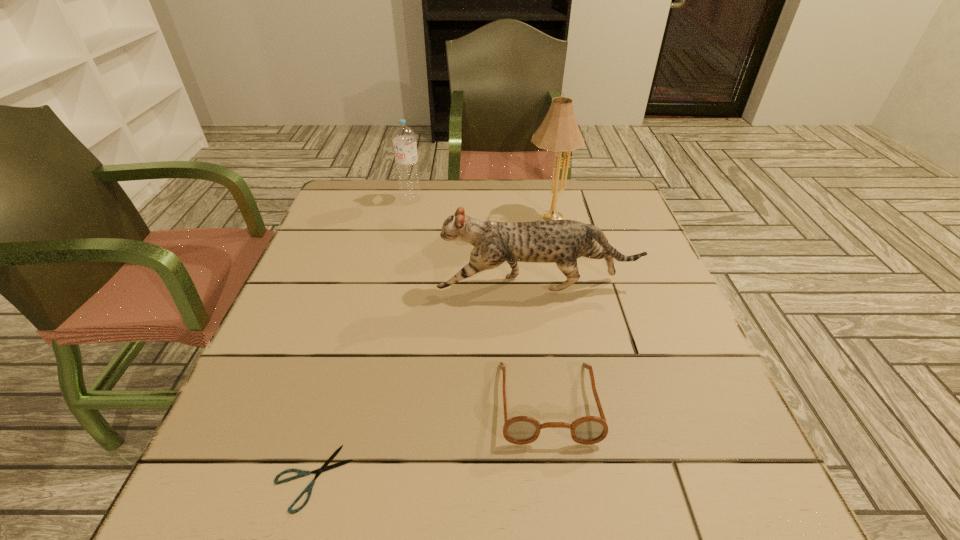
This screenshot has width=960, height=540. I want to click on the tallest object, so click(559, 132).

This screenshot has height=540, width=960. Find the location of `water bottle`. water bottle is located at coordinates (404, 138).

The image size is (960, 540). In order to click on cat in this screenshot , I will do `click(562, 241)`.

Locate an element on the screen. Image resolution: width=960 pixels, height=540 pixels. the third shortest object is located at coordinates (562, 241).

Locate an element on the screen. the fourth tallest object is located at coordinates pyautogui.click(x=520, y=430).

Locate an element on the screen. The image size is (960, 540). shears is located at coordinates (324, 468).

I want to click on vacant region located on the back of the tallest object, so click(x=543, y=187).

Where is `vacant region located on the front of the water bottle`? vacant region located on the front of the water bottle is located at coordinates (407, 217).

Where is `vacant space located 0.230m on the face of the third nearest object`? This screenshot has width=960, height=540. vacant space located 0.230m on the face of the third nearest object is located at coordinates (337, 286).

You are a GUI agent. You are given a task and a screenshot of the screen. Output one action in this format:
    pyautogui.click(x=<x>, y=<y>)
    Task: Click on the free point located on the face of the third nearest object
    This screenshot has width=960, height=540.
    Given the screenshot: What is the action you would take?
    pyautogui.click(x=376, y=286)